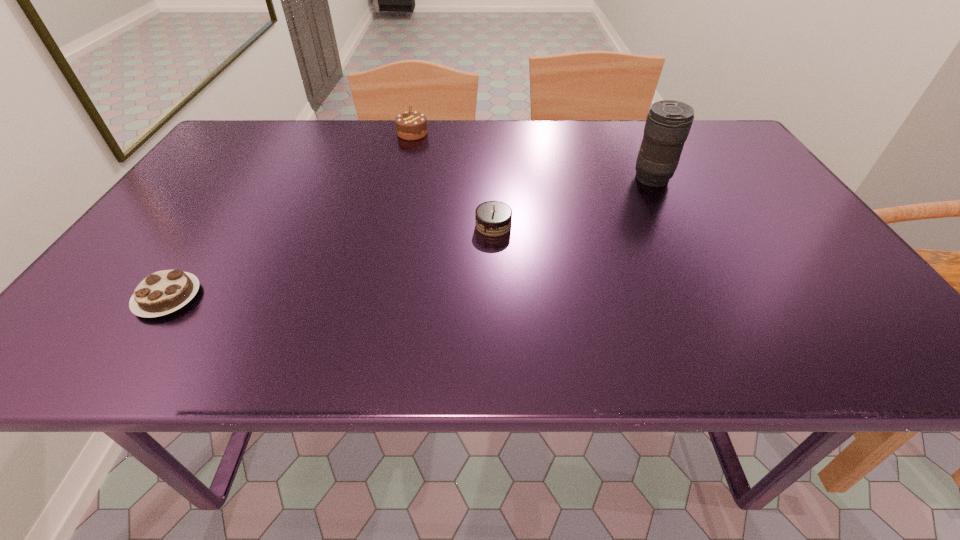
This screenshot has width=960, height=540. I want to click on free space located on the side of the telephoto lens where the control switches are located, so click(x=487, y=179).

Image resolution: width=960 pixels, height=540 pixels. I want to click on free location located on the right of the second chocolate cake from right to left, so click(x=499, y=133).

Where is `blank space located 0.200m on the back of the second farthest chocolate cake`? Image resolution: width=960 pixels, height=540 pixels. blank space located 0.200m on the back of the second farthest chocolate cake is located at coordinates (492, 168).

Locate an element on the screen. free space located 0.090m on the right of the leftmost chocolate cake is located at coordinates (247, 298).

At what (x,y) coordinates should I click in order to perform the action: click on object at the far edge. Please return your answer as a coordinate pair (x, y). This screenshot has height=540, width=960. Looking at the image, I should click on click(x=410, y=125).

At what (x,y) coordinates should I click in order to perform the action: click on object located in the left edge section of the desktop. Please return your answer as a coordinate pair (x, y). This screenshot has height=540, width=960. Looking at the image, I should click on (163, 292).

At what (x,y) coordinates should I click in order to perform the action: click on vacant region at the far edge of the desktop. Please return your answer as a coordinate pair (x, y). The image size is (960, 540). Looking at the image, I should click on (340, 145).

The image size is (960, 540). In the image, there is a desktop. In order to click on vacant area at the left edge in this screenshot , I will do `click(215, 170)`.

The width and height of the screenshot is (960, 540). In the image, there is a desktop. Find the location of `free space at the right edge`. free space at the right edge is located at coordinates (767, 204).

This screenshot has height=540, width=960. I want to click on vacant space at the near left corner of the desktop, so click(x=112, y=331).